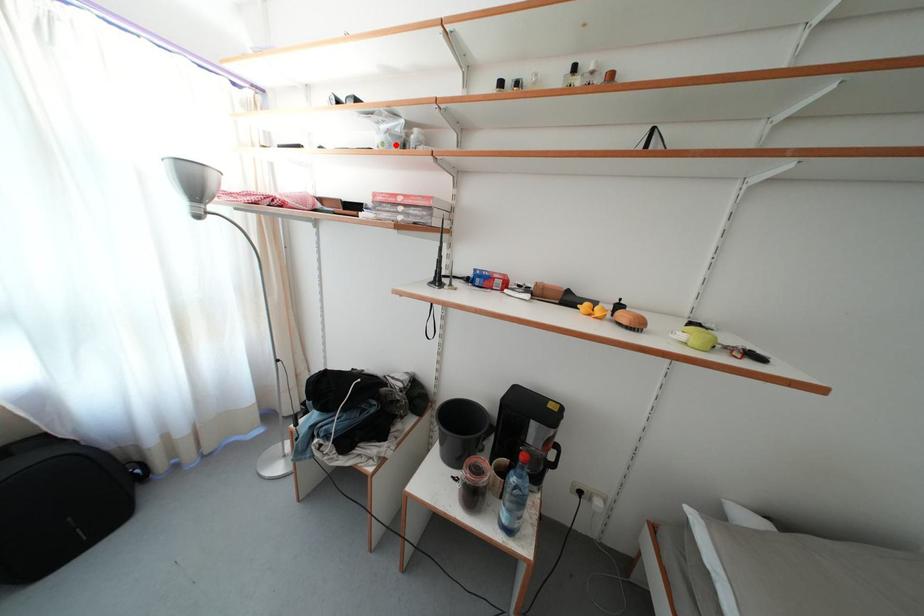
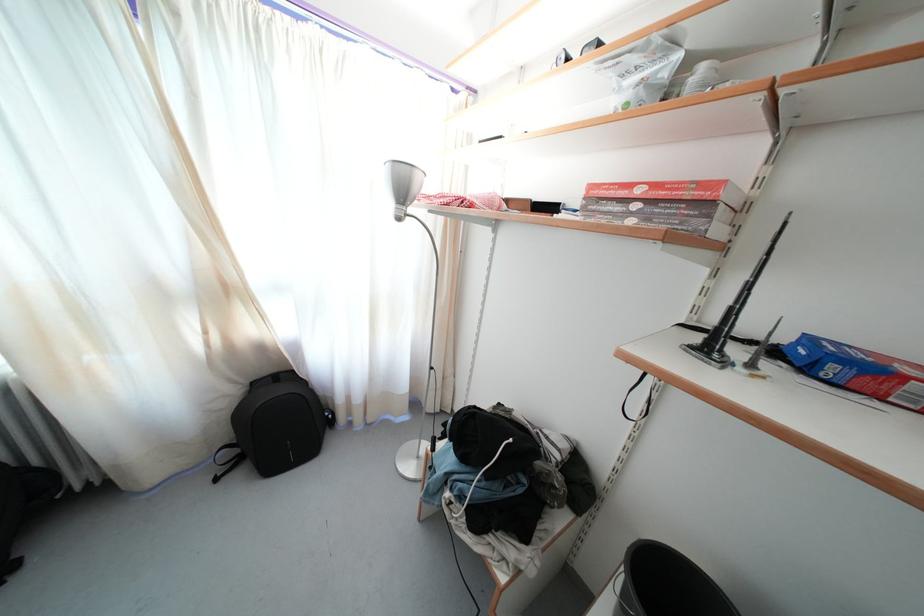
The point at the highlighted location is marked in the first image. Where is the corresponding point in the second image?

(649, 100)